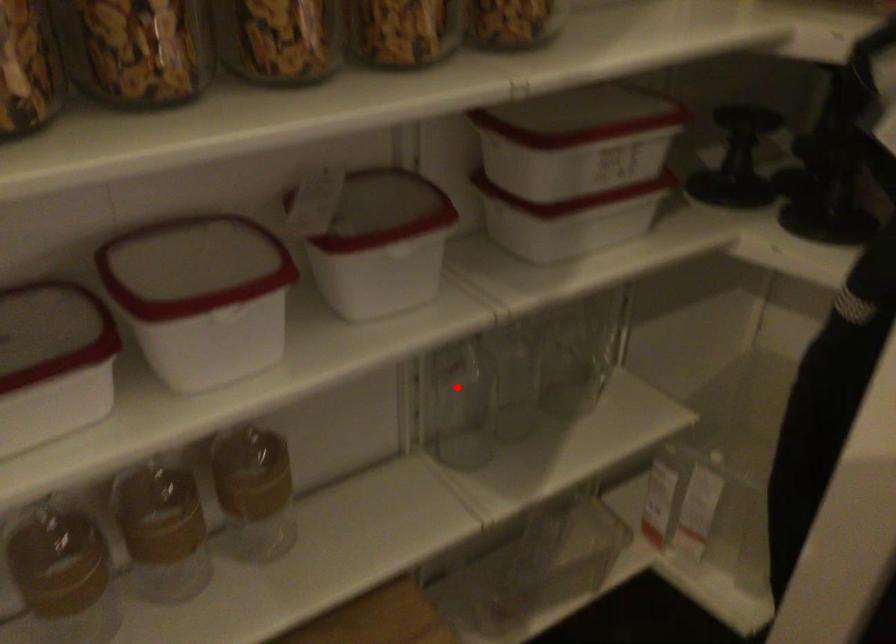
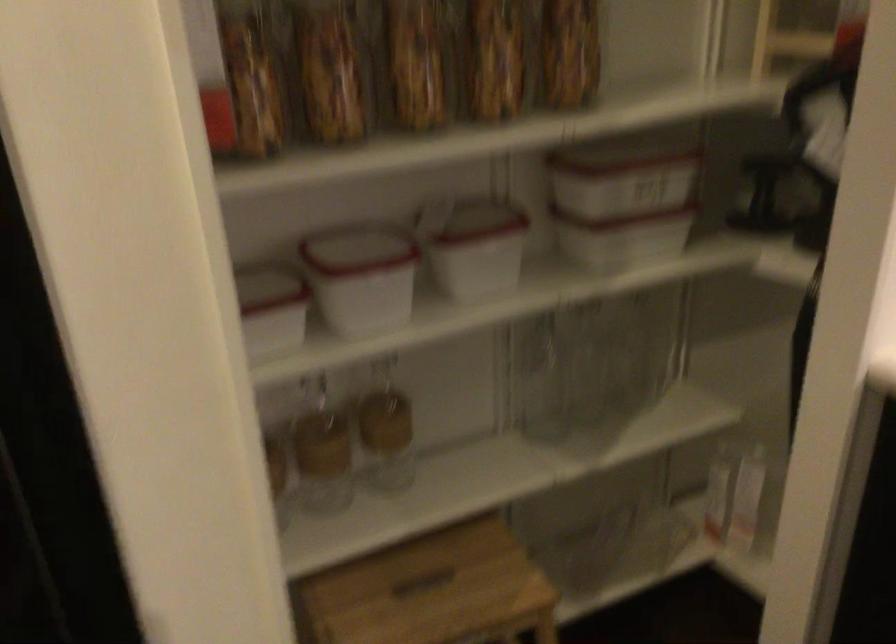
Where in the second image is the point corresponding to the highlighted location from the first image?

(541, 379)